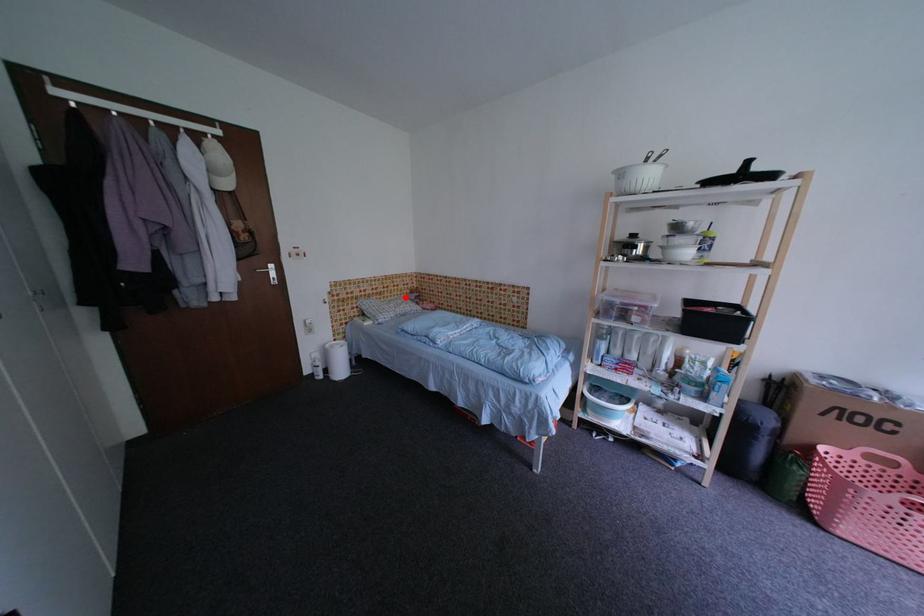
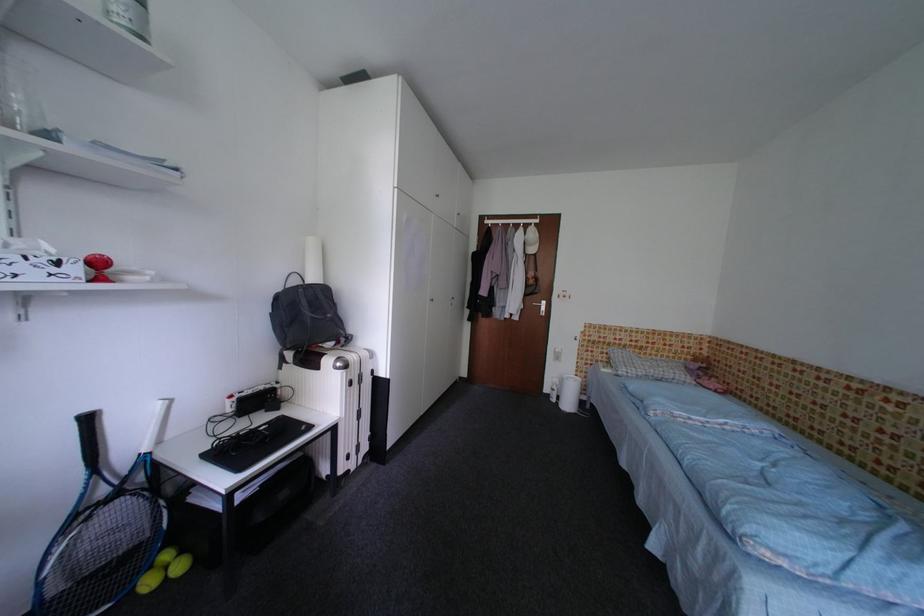
Question: I am providing you with two images of the same scene from different viewpoints. Given a red point in image1, look at the same physical point in image2. Is it:

Choices:
 (A) Closer to the viewpoint
 (B) Farther from the viewpoint

Answer: (B)